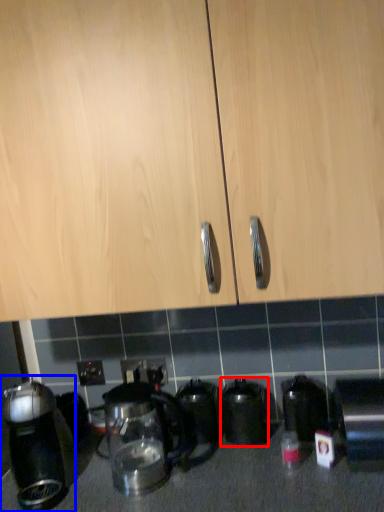
Question: Which object is further to the camera taking this photo, kitchen appliance (highlighted by a red box) or kitchen appliance (highlighted by a blue box)?

Choices:
 (A) kitchen appliance
 (B) kitchen appliance

Answer: (A)